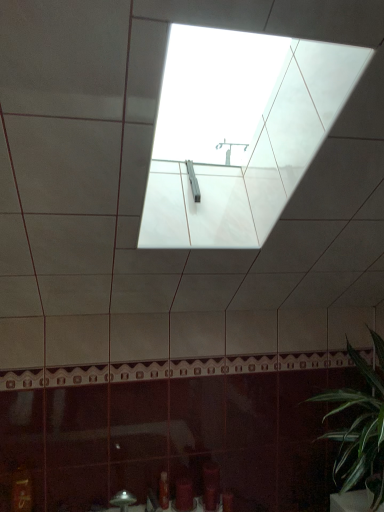
Describe the element at coordinates (360, 426) in the screenshot. Image resolution: width=384 pixels, height=512 pixels. I see `green leafy plant at lower right` at that location.

Where is `translucent plastic bottle at lower center, positioned as the 2th toiletry in right-to-left order`? translucent plastic bottle at lower center, positioned as the 2th toiletry in right-to-left order is located at coordinates (163, 490).

Is green leafy plant at lower right completely or partially inside matte red toiletry at lower center, the 1th toiletry from the right?

No.

Is matte red toiletry at lower center, the 1th toiletry from the right, looking in the opposite direction of green leafy plant at lower right?

No, matte red toiletry at lower center, the 1th toiletry from the right, is not facing the opposite direction of green leafy plant at lower right.

Based on the photo, from a real-world perspective, who is located higher, matte red toiletry at lower center, arranged as the second toiletry when viewed from the left, or green leafy plant at lower right?

green leafy plant at lower right is physically above.

Is matte red toiletry at lower center, the 1th toiletry from the right, in contact with green leafy plant at lower right?

No.

Is matte red toiletry at lower center, arranged as the second toiletry when viewed from the left, situated inside translucent plastic bottle at lower center, acting as the 1th toiletry starting from the left, or outside?

matte red toiletry at lower center, arranged as the second toiletry when viewed from the left, is not inside translucent plastic bottle at lower center, acting as the 1th toiletry starting from the left, it's outside.

You are a GUI agent. You are given a task and a screenshot of the screen. Output one action in this format:
    pyautogui.click(x=<x>, y=<y>)
    Task: Click on the toiletry behind the matte red toiletry at lower center, arranged as the second toiletry when viewed from the left
    This screenshot has height=512, width=384.
    Given the screenshot: What is the action you would take?
    pyautogui.click(x=163, y=490)

Is translucent plastic bottle at lower center, positioned as the 2th toiletry in right-to-left order, at the back of matte red toiletry at lower center, arranged as the second toiletry when viewed from the left?

matte red toiletry at lower center, arranged as the second toiletry when viewed from the left, is not turned away from translucent plastic bottle at lower center, positioned as the 2th toiletry in right-to-left order.

In the image, is matte red toiletry at lower center, arranged as the second toiletry when viewed from the left, positioned in front of or behind translucent plastic bottle at lower center, acting as the 1th toiletry starting from the left?

Visually, matte red toiletry at lower center, arranged as the second toiletry when viewed from the left, is located in front of translucent plastic bottle at lower center, acting as the 1th toiletry starting from the left.

Choose the correct answer: Is translucent plastic bottle at lower center, acting as the 1th toiletry starting from the left, inside green leafy plant at lower right or outside it?

translucent plastic bottle at lower center, acting as the 1th toiletry starting from the left, is spatially situated outside green leafy plant at lower right.

Is translucent plastic bottle at lower center, acting as the 1th toiletry starting from the left, far away from green leafy plant at lower right?

Actually, translucent plastic bottle at lower center, acting as the 1th toiletry starting from the left, and green leafy plant at lower right are a little close together.

Find the location of a particular element. toiletry that is the 2nd object located behind the green leafy plant at lower right is located at coordinates (163, 490).

Which of these two, translucent plastic bottle at lower center, positioned as the 2th toiletry in right-to-left order, or green leafy plant at lower right, is wider?

With larger width is green leafy plant at lower right.

From a real-world perspective, is green leafy plant at lower right positioned under matte red toiletry at lower center, the 1th toiletry from the right, based on gravity?

No.

Image resolution: width=384 pixels, height=512 pixels. I want to click on houseplant lying on the right of matte red toiletry at lower center, arranged as the second toiletry when viewed from the left, so click(x=360, y=426).

Between green leafy plant at lower right and matte red toiletry at lower center, arranged as the second toiletry when viewed from the left, which one appears on the left side from the viewer's perspective?

Positioned to the left is matte red toiletry at lower center, arranged as the second toiletry when viewed from the left.

Considering the relative sizes of green leafy plant at lower right and matte red toiletry at lower center, the 1th toiletry from the right, in the image provided, is green leafy plant at lower right bigger than matte red toiletry at lower center, the 1th toiletry from the right,?

Yes, green leafy plant at lower right is bigger than matte red toiletry at lower center, the 1th toiletry from the right.

Does green leafy plant at lower right have a lesser width compared to translucent plastic bottle at lower center, acting as the 1th toiletry starting from the left?

No.

From the image's perspective, is green leafy plant at lower right located beneath translucent plastic bottle at lower center, acting as the 1th toiletry starting from the left?

No.

Find the location of a particular element. houseplant on the right of translucent plastic bottle at lower center, acting as the 1th toiletry starting from the left is located at coordinates (360, 426).

Image resolution: width=384 pixels, height=512 pixels. In order to click on toiletry above the matte red toiletry at lower center, the 1th toiletry from the right (from a real-world perspective) in this screenshot , I will do `click(163, 490)`.

Could you tell me if translucent plastic bottle at lower center, positioned as the 2th toiletry in right-to-left order, is facing matte red toiletry at lower center, the 1th toiletry from the right?

No, translucent plastic bottle at lower center, positioned as the 2th toiletry in right-to-left order, does not turn towards matte red toiletry at lower center, the 1th toiletry from the right.

Between point (164, 494) and point (178, 493), which one is positioned in front?

The point (164, 494) is closer to the camera.

Is translucent plastic bottle at lower center, acting as the 1th toiletry starting from the left, positioned before matte red toiletry at lower center, arranged as the second toiletry when viewed from the left?

No, translucent plastic bottle at lower center, acting as the 1th toiletry starting from the left, is further to the viewer.

Where is `the 2nd toiletry below the green leafy plant at lower right (from the image's perspective)`? the 2nd toiletry below the green leafy plant at lower right (from the image's perspective) is located at coordinates (184, 494).

This screenshot has height=512, width=384. I want to click on toiletry on the left of matte red toiletry at lower center, the 1th toiletry from the right, so click(x=163, y=490).

Which object lies further to the anchor point translucent plastic bottle at lower center, acting as the 1th toiletry starting from the left, green leafy plant at lower right or matte red toiletry at lower center, arranged as the second toiletry when viewed from the left?

green leafy plant at lower right lies further to translucent plastic bottle at lower center, acting as the 1th toiletry starting from the left, than the other object.

Which object lies further to the anchor point matte red toiletry at lower center, arranged as the second toiletry when viewed from the left, green leafy plant at lower right or translucent plastic bottle at lower center, acting as the 1th toiletry starting from the left?

Based on the image, green leafy plant at lower right appears to be further to matte red toiletry at lower center, arranged as the second toiletry when viewed from the left.

Based on their spatial positions, is translucent plastic bottle at lower center, acting as the 1th toiletry starting from the left, or matte red toiletry at lower center, arranged as the second toiletry when viewed from the left, further from green leafy plant at lower right?

translucent plastic bottle at lower center, acting as the 1th toiletry starting from the left, is positioned further to the anchor green leafy plant at lower right.

Considering their positions, is translucent plastic bottle at lower center, acting as the 1th toiletry starting from the left, positioned closer to matte red toiletry at lower center, arranged as the second toiletry when viewed from the left, than green leafy plant at lower right?

translucent plastic bottle at lower center, acting as the 1th toiletry starting from the left, is closer to matte red toiletry at lower center, arranged as the second toiletry when viewed from the left.

When comparing their distances from translucent plastic bottle at lower center, positioned as the 2th toiletry in right-to-left order, does matte red toiletry at lower center, arranged as the second toiletry when viewed from the left, or green leafy plant at lower right seem further?

green leafy plant at lower right lies further to translucent plastic bottle at lower center, positioned as the 2th toiletry in right-to-left order, than the other object.

Based on their spatial positions, is matte red toiletry at lower center, the 1th toiletry from the right, or translucent plastic bottle at lower center, positioned as the 2th toiletry in right-to-left order, closer to green leafy plant at lower right?

The object closer to green leafy plant at lower right is matte red toiletry at lower center, the 1th toiletry from the right.

Find the location of a particular element. The height and width of the screenshot is (512, 384). toiletry situated between translucent plastic bottle at lower center, acting as the 1th toiletry starting from the left, and green leafy plant at lower right from left to right is located at coordinates (184, 494).